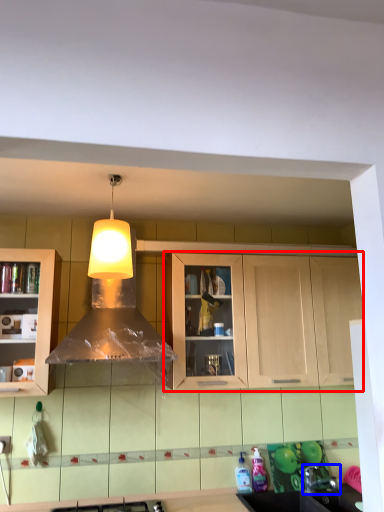
Question: Which of the following is the closest to the observer, cabinetry (highlighted by a red box) or faucet (highlighted by a blue box)?

Choices:
 (A) cabinetry
 (B) faucet

Answer: (B)